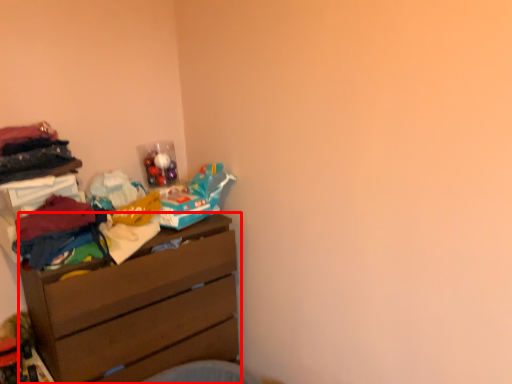
Question: From the image's perspective, considering the relative positions of chest of drawers (annotated by the red box) and clothing in the image provided, where is chest of drawers (annotated by the red box) located with respect to the staircase?

Choices:
 (A) below
 (B) above

Answer: (A)